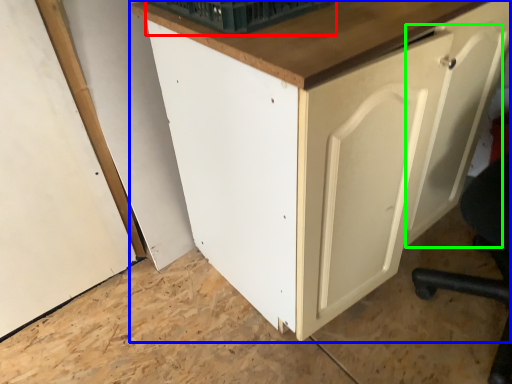
Question: Which object is the closest to the basket (highlighted by a red box)? Choose among these: cabinetry (highlighted by a blue box) or door (highlighted by a green box).

Choices:
 (A) cabinetry
 (B) door

Answer: (A)